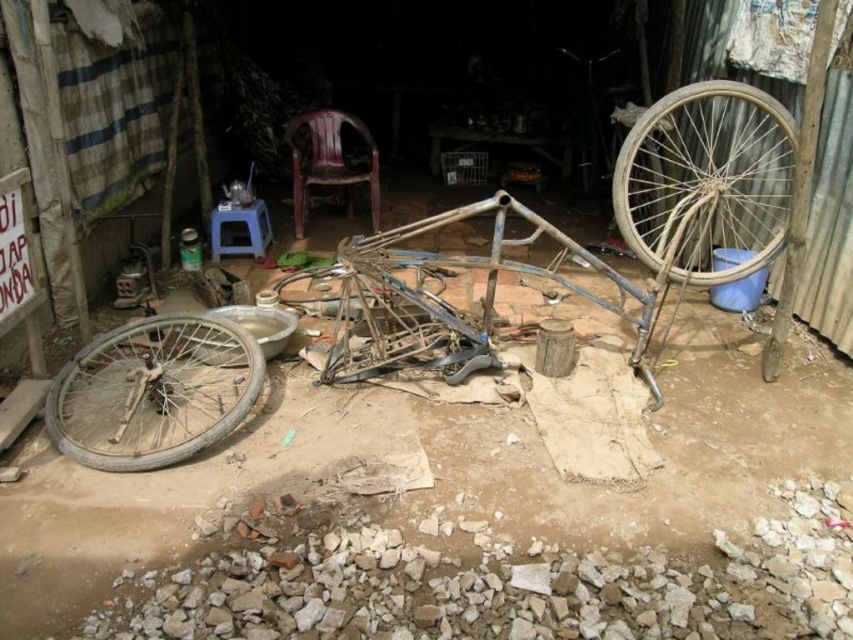
Question: Which object appears farthest from the camera in this image?

Choices:
 (A) rusty metal wheel at right
 (B) rusty metal bicycle frame at center
 (C) rusty metal wheel at lower left

Answer: (B)

Question: Among these objects, which one is farthest from the camera?

Choices:
 (A) rusty metal wheel at lower left
 (B) rusty metal wheel at right

Answer: (B)

Question: Is rusty metal wheel at right closer to camera compared to rusty metal wheel at lower left?

Choices:
 (A) yes
 (B) no

Answer: (B)

Question: Is rusty metal bicycle frame at center below rusty metal wheel at right?

Choices:
 (A) no
 (B) yes

Answer: (B)

Question: Where is rusty metal wheel at right located in relation to rusty metal wheel at lower left in the image?

Choices:
 (A) above
 (B) below

Answer: (A)

Question: Which object is positioned farthest from the rusty metal wheel at right?

Choices:
 (A) rusty metal wheel at lower left
 (B) rusty metal bicycle frame at center

Answer: (A)